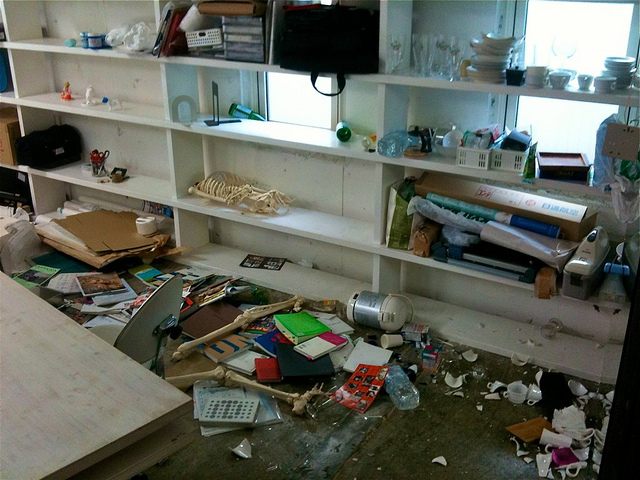
Locate an element on the screen. white shelf is located at coordinates (38, 43), (41, 98), (68, 176), (278, 227), (278, 140), (440, 169), (413, 256), (381, 210), (169, 163), (22, 118).